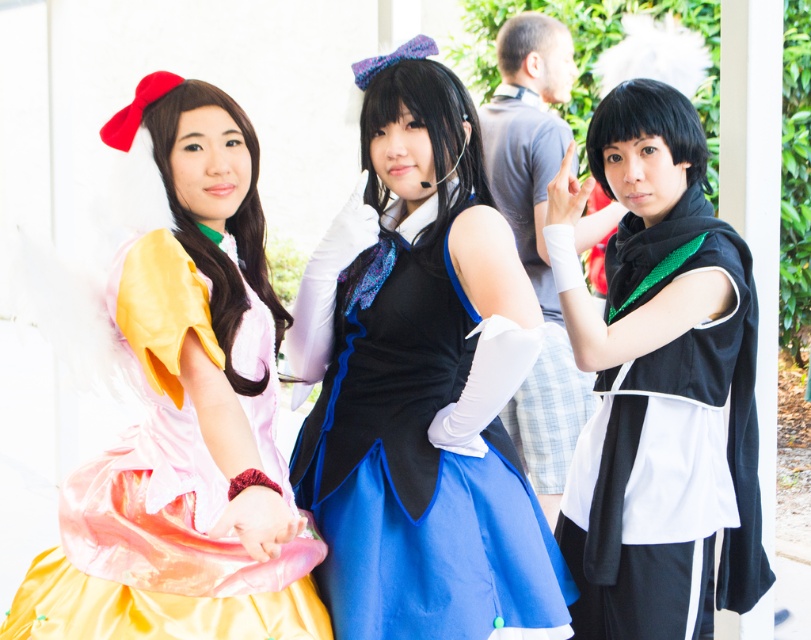
Question: Is satin dress at left to the left of blue satin dress at center from the viewer's perspective?

Choices:
 (A) no
 (B) yes

Answer: (B)

Question: Which point appears closest to the camera in this image?

Choices:
 (A) (252, 522)
 (B) (593, 609)
 (C) (333, 230)

Answer: (A)

Question: Can you confirm if satin dress at left is thinner than black matte uniform at right?

Choices:
 (A) no
 (B) yes

Answer: (A)

Question: Which is nearer to the blue satin dress at center?

Choices:
 (A) black matte uniform at right
 (B) satin dress at left

Answer: (B)

Question: Among these objects, which one is farthest from the camera?

Choices:
 (A) black matte uniform at right
 (B) satin dress at left
 (C) blue satin dress at center

Answer: (A)

Question: Can you confirm if satin dress at left is smaller than blue satin dress at center?

Choices:
 (A) no
 (B) yes

Answer: (A)